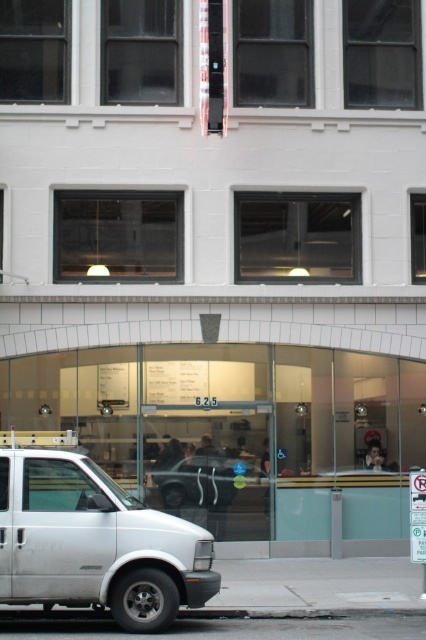
Looking at this image, who is shorter, white matte van at lower left or metallic silver car at center?

metallic silver car at center is shorter.

Is point (112, 605) closer to camera compared to point (166, 502)?

Yes, point (112, 605) is in front of point (166, 502).

Is point (43, 504) positioned before point (252, 468)?

Yes, point (43, 504) is in front of point (252, 468).

I want to click on white matte van at lower left, so click(x=92, y=538).